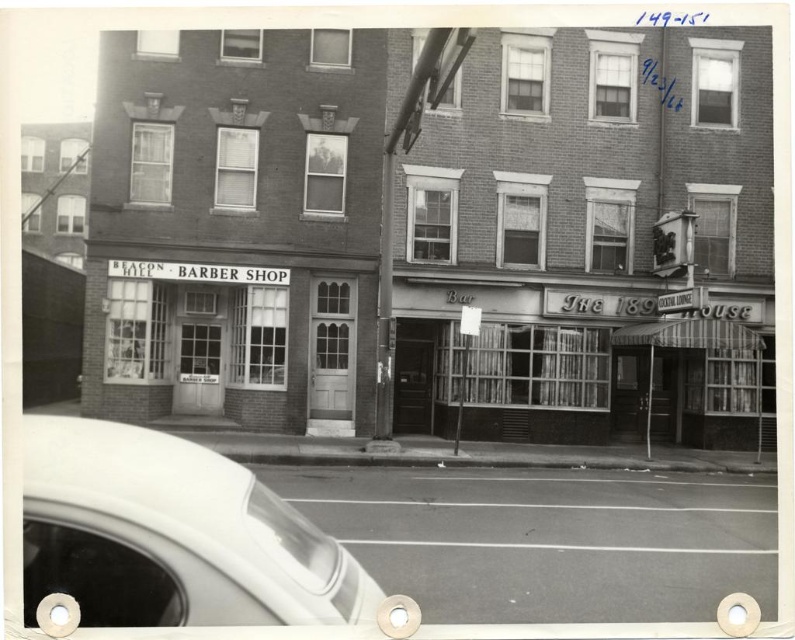
Question: Can you confirm if white glossy car at lower left is positioned below matte glass windows at center?

Choices:
 (A) yes
 (B) no

Answer: (B)

Question: Does white glossy car at lower left have a greater width compared to matte glass windows at center?

Choices:
 (A) yes
 (B) no

Answer: (A)

Question: Which point is farther to the camera?

Choices:
 (A) (165, 561)
 (B) (501, 394)

Answer: (B)

Question: Is white glossy car at lower left in front of matte glass windows at center?

Choices:
 (A) yes
 (B) no

Answer: (A)